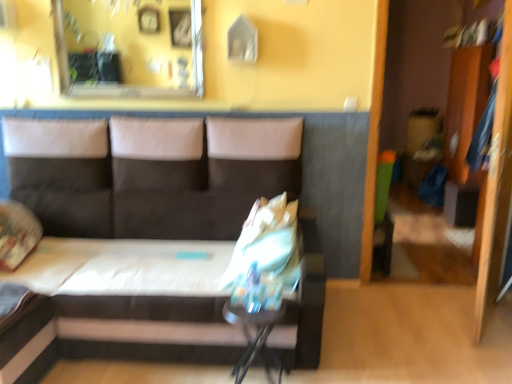
Measure the distance between point (195, 34) and camera.

Point (195, 34) is 9.41 feet away from camera.

What do you see at coordinates (465, 105) in the screenshot? The width and height of the screenshot is (512, 384). I see `wooden dresser at right` at bounding box center [465, 105].

Where is `metallic glossy table at lower center`? Image resolution: width=512 pixels, height=384 pixels. metallic glossy table at lower center is located at coordinates (255, 336).

Which object is positioned more to the right, clear glass mirror at upper center or metallic glossy table at lower center?

From the viewer's perspective, metallic glossy table at lower center appears more on the right side.

How much distance is there between clear glass mirror at upper center and metallic glossy table at lower center?

A distance of 6.40 feet exists between clear glass mirror at upper center and metallic glossy table at lower center.

What's the angular difference between clear glass mirror at upper center and metallic glossy table at lower center's facing directions?

clear glass mirror at upper center and metallic glossy table at lower center are facing 1.42 degrees away from each other.

Is clear glass mirror at upper center not within metallic glossy table at lower center?

clear glass mirror at upper center is positioned outside metallic glossy table at lower center.

From a real-world perspective, who is located lower, wooden dresser at right or dark gray fabric couch at center?

From a 3D spatial view, dark gray fabric couch at center is below.

Which of these two, wooden dresser at right or dark gray fabric couch at center, is bigger?

dark gray fabric couch at center is bigger.

Does wooden dresser at right appear on the left side of dark gray fabric couch at center?

No, wooden dresser at right is not to the left of dark gray fabric couch at center.

The width and height of the screenshot is (512, 384). In order to click on studio couch that appears in front of the wooden dresser at right in this screenshot , I will do `click(150, 173)`.

How different are the orientations of dark gray fabric couch at center and wooden dresser at right in degrees?

The facing directions of dark gray fabric couch at center and wooden dresser at right are 91.9 degrees apart.

In the scene shown: From a real-world perspective, does dark gray fabric couch at center sit lower than wooden dresser at right?

Yes, from a real-world perspective, dark gray fabric couch at center is beneath wooden dresser at right.

Can you confirm if dark gray fabric couch at center is positioned to the left of wooden dresser at right?

Correct, you'll find dark gray fabric couch at center to the left of wooden dresser at right.

From a real-world perspective, is dark gray fabric couch at center physically above metallic glossy table at lower center?

Yes, from a real-world perspective, dark gray fabric couch at center is above metallic glossy table at lower center.

Does dark gray fabric couch at center have a lesser width compared to metallic glossy table at lower center?

In fact, dark gray fabric couch at center might be wider than metallic glossy table at lower center.

Is dark gray fabric couch at center next to metallic glossy table at lower center and touching it?

No, dark gray fabric couch at center is not beside metallic glossy table at lower center.

Is wooden dresser at right beside metallic glossy table at lower center?

No, wooden dresser at right is not making contact with metallic glossy table at lower center.

Locate an element on the screen. This screenshot has width=512, height=384. table lying in front of the wooden dresser at right is located at coordinates (255, 336).

Considering the positions of point (452, 106) and point (267, 377), is point (452, 106) closer or farther from the camera than point (267, 377)?

Clearly, point (452, 106) is more distant from the camera than point (267, 377).

Is clear glass mirror at upper center positioned behind dark gray fabric couch at center?

Yes, the depth of clear glass mirror at upper center is greater than that of dark gray fabric couch at center.

This screenshot has height=384, width=512. I want to click on mirror positioned vertically above the dark gray fabric couch at center (from a real-world perspective), so [129, 48].

Is clear glass mirror at upper center oriented towards dark gray fabric couch at center?

No, clear glass mirror at upper center does not turn towards dark gray fabric couch at center.

Is point (142, 38) farther from camera compared to point (88, 333)?

Yes, point (142, 38) is farther from viewer.

Considering the sizes of clear glass mirror at upper center and wooden dresser at right in the image, is clear glass mirror at upper center wider or thinner than wooden dresser at right?

Considering their sizes, clear glass mirror at upper center looks slimmer than wooden dresser at right.

Which is behind, point (99, 69) or point (456, 131)?

Positioned behind is point (456, 131).

Are clear glass mirror at upper center and wooden dresser at right beside each other?

There is a gap between clear glass mirror at upper center and wooden dresser at right.

How different are the orientations of clear glass mirror at upper center and wooden dresser at right in degrees?

The angular difference between clear glass mirror at upper center and wooden dresser at right is 91.7 degrees.

In order to click on mirror that appears above the metallic glossy table at lower center (from a real-world perspective) in this screenshot , I will do `click(129, 48)`.

The image size is (512, 384). In order to click on dresser above the dark gray fabric couch at center (from the image's perspective) in this screenshot , I will do `click(465, 105)`.

From the picture: Estimate the real-world distances between objects in this image. Which object is further from wooden dresser at right, metallic glossy table at lower center or clear glass mirror at upper center?

The object further to wooden dresser at right is metallic glossy table at lower center.

Which object lies further to the anchor point wooden dresser at right, metallic glossy table at lower center or dark gray fabric couch at center?

metallic glossy table at lower center is further to wooden dresser at right.

From the image, which object appears to be farther from dark gray fabric couch at center, metallic glossy table at lower center or wooden dresser at right?

Among the two, wooden dresser at right is located further to dark gray fabric couch at center.

Looking at the image, which one is located closer to metallic glossy table at lower center, dark gray fabric couch at center or wooden dresser at right?

dark gray fabric couch at center is closer to metallic glossy table at lower center.

Considering their positions, is metallic glossy table at lower center positioned closer to dark gray fabric couch at center than clear glass mirror at upper center?

metallic glossy table at lower center is closer to dark gray fabric couch at center.

Considering their positions, is metallic glossy table at lower center positioned closer to clear glass mirror at upper center than dark gray fabric couch at center?

Based on the image, dark gray fabric couch at center appears to be nearer to clear glass mirror at upper center.

Looking at this image, which object lies nearer to the anchor point clear glass mirror at upper center, metallic glossy table at lower center or wooden dresser at right?

metallic glossy table at lower center is positioned closer to the anchor clear glass mirror at upper center.

From the image, which object appears to be farther from dark gray fabric couch at center, wooden dresser at right or clear glass mirror at upper center?

wooden dresser at right is positioned further to the anchor dark gray fabric couch at center.

In order to click on studio couch between clear glass mirror at upper center and metallic glossy table at lower center from top to bottom in this screenshot , I will do `click(150, 173)`.

Find the location of a particular element. The width and height of the screenshot is (512, 384). table situated between dark gray fabric couch at center and wooden dresser at right from left to right is located at coordinates (255, 336).

Where is `table situated between clear glass mirror at upper center and wooden dresser at right from left to right`? The height and width of the screenshot is (384, 512). table situated between clear glass mirror at upper center and wooden dresser at right from left to right is located at coordinates (255, 336).

You are a GUI agent. You are given a task and a screenshot of the screen. Output one action in this format:
    pyautogui.click(x=<x>, y=<y>)
    Task: Click on the studio couch situated between clear glass mirror at upper center and wooden dresser at right from left to right
    The image size is (512, 384).
    Given the screenshot: What is the action you would take?
    pyautogui.click(x=150, y=173)